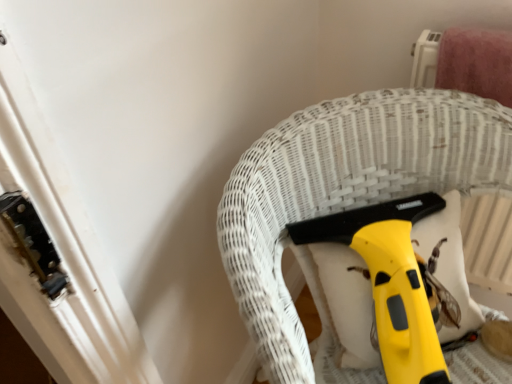
Question: Are yellow plastic vacuum cleaner at center and yellow plastic squeegee at center far apart?

Choices:
 (A) yes
 (B) no

Answer: (B)

Question: Is yellow plastic vacuum cleaner at center positioned in front of yellow plastic squeegee at center?

Choices:
 (A) yes
 (B) no

Answer: (A)

Question: Is yellow plastic squeegee at center located within yellow plastic vacuum cleaner at center?

Choices:
 (A) no
 (B) yes

Answer: (B)

Question: Considering the relative sizes of yellow plastic vacuum cleaner at center and yellow plastic squeegee at center in the image provided, is yellow plastic vacuum cleaner at center wider than yellow plastic squeegee at center?

Choices:
 (A) no
 (B) yes

Answer: (B)

Question: Is yellow plastic vacuum cleaner at center positioned beyond the bounds of yellow plastic squeegee at center?

Choices:
 (A) yes
 (B) no

Answer: (A)

Question: Could you tell me if yellow plastic vacuum cleaner at center is turned towards yellow plastic squeegee at center?

Choices:
 (A) no
 (B) yes

Answer: (B)

Question: Is yellow plastic squeegee at center facing towards yellow plastic vacuum cleaner at center?

Choices:
 (A) no
 (B) yes

Answer: (B)

Question: Would you say yellow plastic squeegee at center is outside yellow plastic vacuum cleaner at center?

Choices:
 (A) yes
 (B) no

Answer: (B)

Question: Can you confirm if yellow plastic squeegee at center is bigger than yellow plastic vacuum cleaner at center?

Choices:
 (A) no
 (B) yes

Answer: (A)

Question: Considering the relative sizes of yellow plastic squeegee at center and yellow plastic vacuum cleaner at center in the image provided, is yellow plastic squeegee at center wider than yellow plastic vacuum cleaner at center?

Choices:
 (A) yes
 (B) no

Answer: (B)

Question: From a real-world perspective, is yellow plastic squeegee at center below yellow plastic vacuum cleaner at center?

Choices:
 (A) no
 (B) yes

Answer: (A)

Question: From a real-world perspective, is yellow plastic squeegee at center physically above yellow plastic vacuum cleaner at center?

Choices:
 (A) no
 (B) yes

Answer: (B)

Question: Considering their positions, is yellow plastic squeegee at center located in front of or behind yellow plastic vacuum cleaner at center?

Choices:
 (A) behind
 (B) front

Answer: (A)